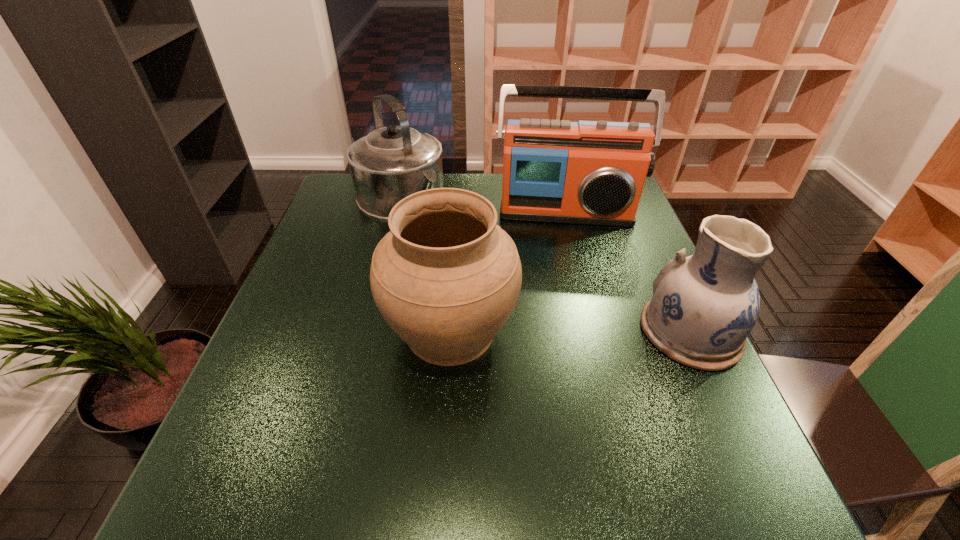
This screenshot has width=960, height=540. Find the location of `vacant area in the image that satisfies the following two spatial constraints: 1. on the front side of the pottery; 2. on the left side of the radio receiver`. vacant area in the image that satisfies the following two spatial constraints: 1. on the front side of the pottery; 2. on the left side of the radio receiver is located at coordinates (596, 332).

Locate an element on the screen. This screenshot has width=960, height=540. vacant area in the image that satisfies the following two spatial constraints: 1. on the front side of the kettle; 2. on the right side of the radio receiver is located at coordinates (396, 212).

Where is `free space that satisfies the following two spatial constraints: 1. on the back side of the urn; 2. on the left side of the radio receiver`? This screenshot has width=960, height=540. free space that satisfies the following two spatial constraints: 1. on the back side of the urn; 2. on the left side of the radio receiver is located at coordinates (458, 212).